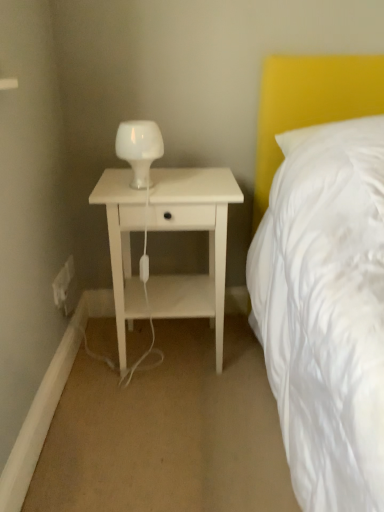
The image size is (384, 512). I want to click on vacant space in front of white matte nightstand at center, so click(x=169, y=440).